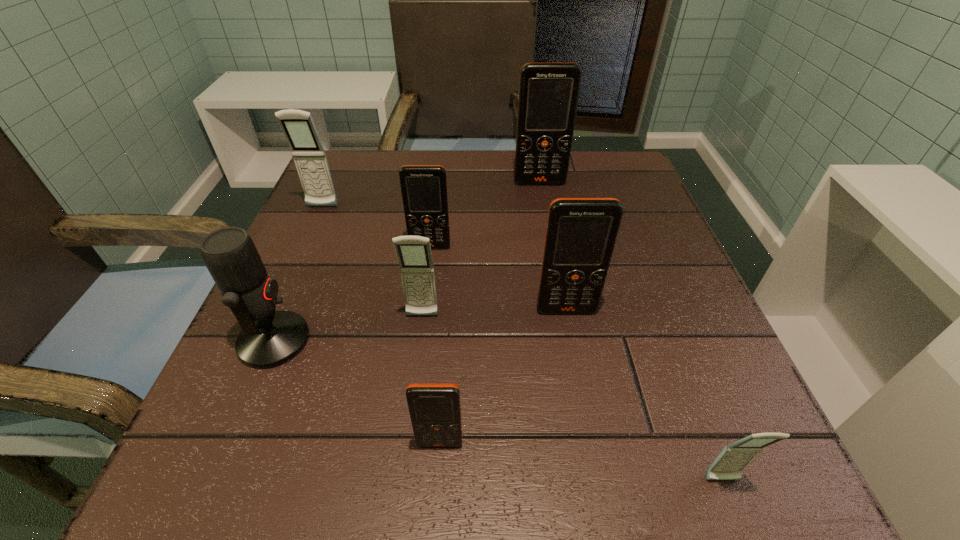
This screenshot has width=960, height=540. Find the location of `object that stands as the sixth closest to the rightmost cellular telephone`. object that stands as the sixth closest to the rightmost cellular telephone is located at coordinates (548, 92).

Identify the location of cellular telephone that is the second closest to the rightmost gray cellular telephone. This screenshot has width=960, height=540. (435, 411).

This screenshot has height=540, width=960. I want to click on cellular telephone that is the second closest to the second biggest gray cellular telephone, so click(x=581, y=233).

Point out which orange cellular telephone is positioned as the nearest to the third nearest orange cellular telephone. Please provide its 2D coordinates. Your answer should be formatted as a tuple, i.e. [(x, y)], where the tuple contains the x and y coordinates of a point satisfying the conditions above.

[(581, 233)]

Find the location of `orange cellular telephone that is the closest one to the third farthest orange cellular telephone`. orange cellular telephone that is the closest one to the third farthest orange cellular telephone is located at coordinates point(424,187).

You are a GUI agent. You are given a task and a screenshot of the screen. Output one action in this format:
    pyautogui.click(x=<x>, y=<y>)
    Task: Click on the second closest gray cellular telephone to the third biggest orange cellular telephone
    This screenshot has height=540, width=960.
    Given the screenshot: What is the action you would take?
    pyautogui.click(x=309, y=156)

Select which gray cellular telephone is the closest to the second gray cellular telephone from left to right. Please provide its 2D coordinates. Your answer should be formatted as a tuple, i.e. [(x, y)], where the tuple contains the x and y coordinates of a point satisfying the conditions above.

[(309, 156)]

Where is `blank area in the image that satisfies the following two spatial constraints: 1. on the front-facing side of the second nearest gray cellular telephone; 2. on the side of the microphone with the red ring`? The width and height of the screenshot is (960, 540). blank area in the image that satisfies the following two spatial constraints: 1. on the front-facing side of the second nearest gray cellular telephone; 2. on the side of the microphone with the red ring is located at coordinates (420, 341).

Locate an element on the screen. This screenshot has width=960, height=540. vacant space that satisfies the following two spatial constraints: 1. on the screen of the third nearest orange cellular telephone; 2. on the side of the microphone with the red ring is located at coordinates (419, 341).

Identify the location of vacant space that satisfies the following two spatial constraints: 1. on the screen of the third smallest orange cellular telephone; 2. on the side of the microphone with the red ring. The width and height of the screenshot is (960, 540). (572, 341).